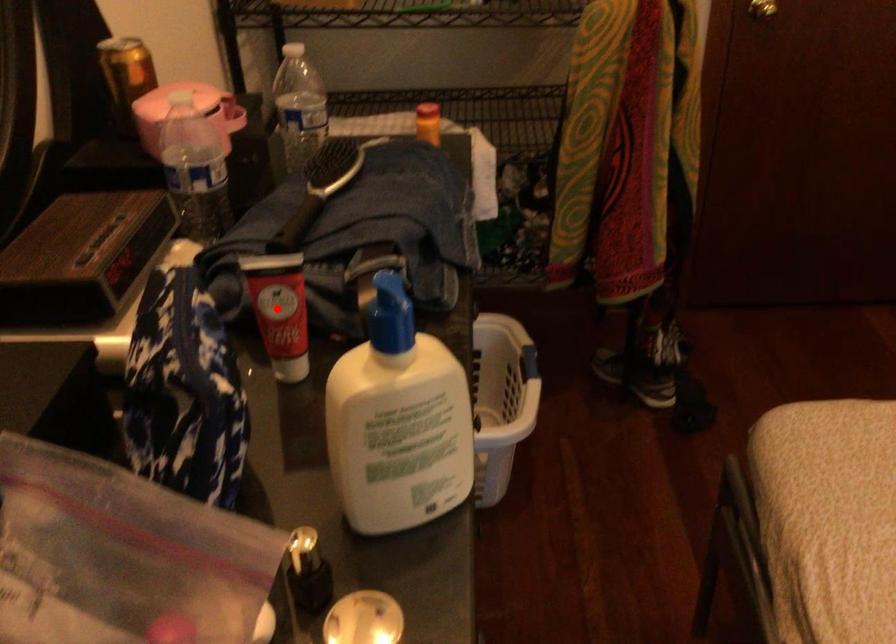
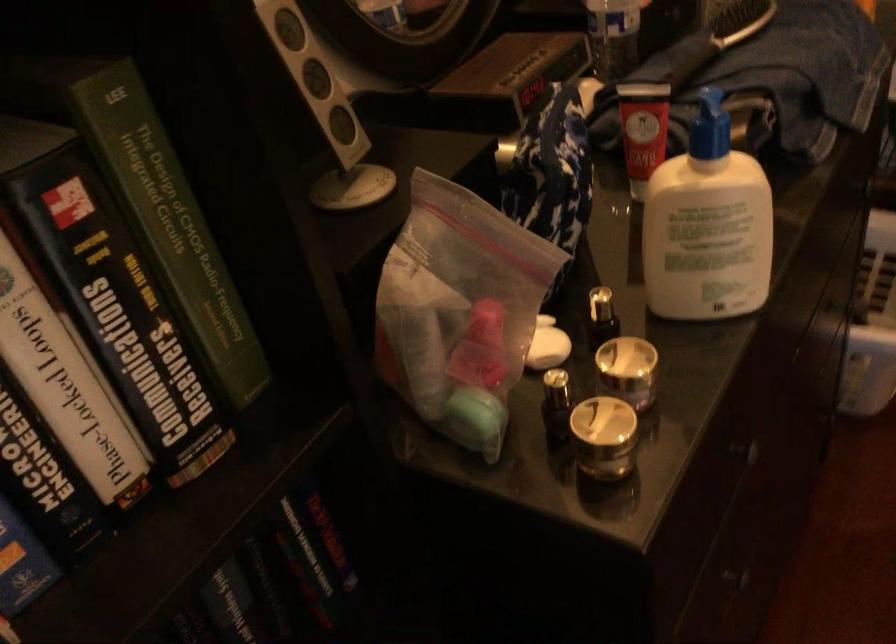
The point at the highlighted location is marked in the first image. Where is the corresponding point in the second image?

(642, 129)